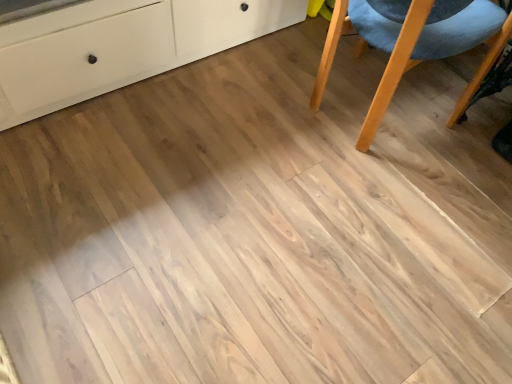
Locate an element on the screen. free point in front of light wood chair at right is located at coordinates (439, 179).